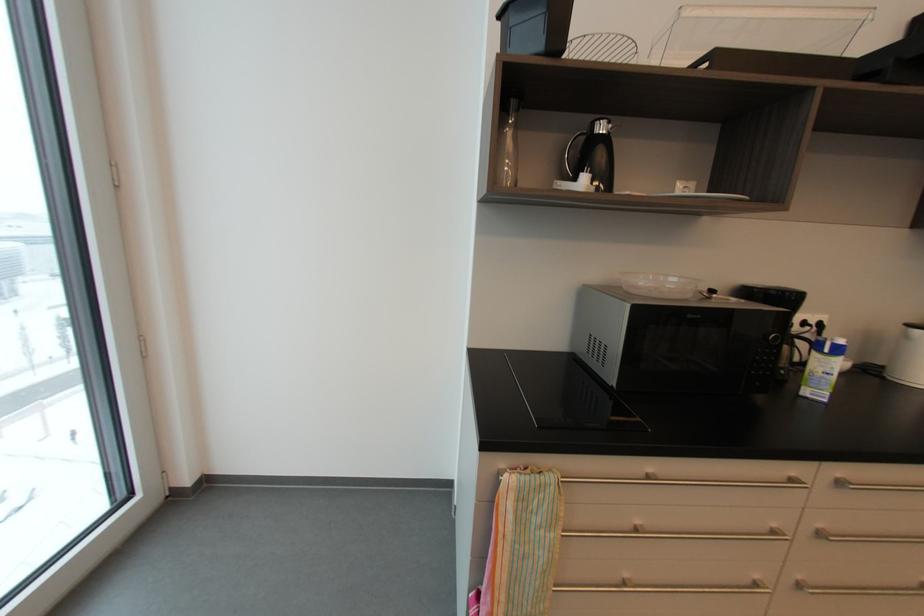
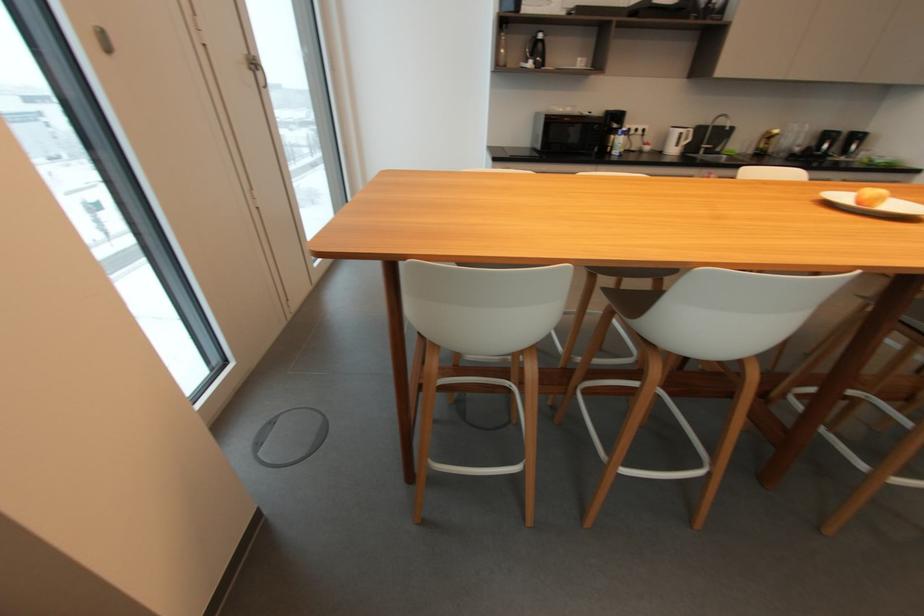
The point at (603, 128) is marked in the first image. Where is the corresponding point in the second image?

(544, 36)